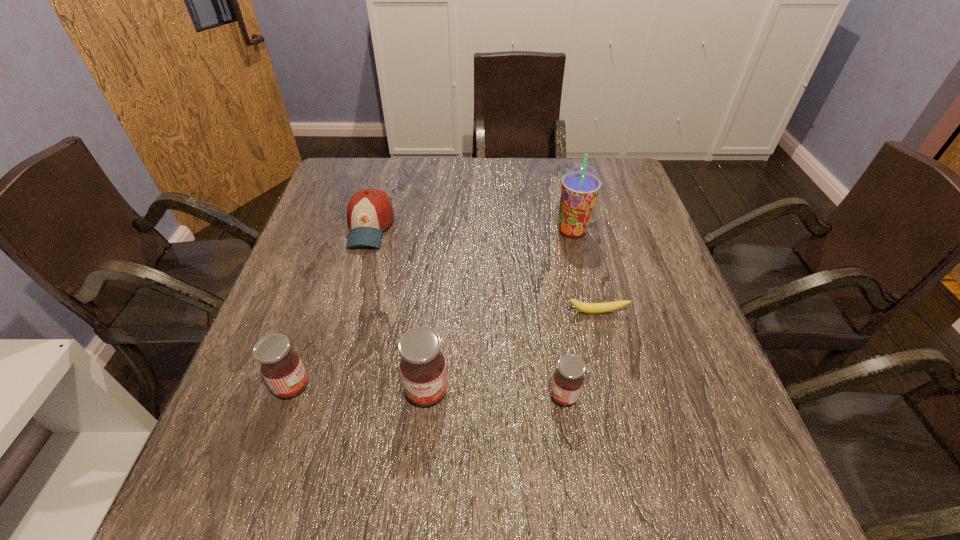
The width and height of the screenshot is (960, 540). I want to click on vacant space that's between the rightmost jam and the baseball cap, so click(467, 312).

What are the coordinates of `free space that is in between the rightmost jam and the baseball cap` in the screenshot? It's located at (467, 312).

Locate an element on the screen. The height and width of the screenshot is (540, 960). vacant area that lies between the fourth nearest object and the third object from right to left is located at coordinates (x=581, y=354).

This screenshot has height=540, width=960. I want to click on free space between the tallest jam and the smoothie, so click(499, 311).

Locate an element on the screen. This screenshot has height=540, width=960. free point between the leftmost jam and the tallest jam is located at coordinates (360, 388).

Locate an element on the screen. The height and width of the screenshot is (540, 960). vacant space that's between the tallest object and the tallest jam is located at coordinates (499, 311).

Identify the location of vacant space that is in between the leftmost jam and the tallest object. (432, 308).

Locate an element on the screen. This screenshot has width=960, height=540. free point between the shortest object and the smoothie is located at coordinates click(x=585, y=272).

This screenshot has width=960, height=540. I want to click on vacant area that lies between the fourth object from left to right and the tallest jam, so click(495, 393).

Choose which object is the second nearest neighbor to the fourth shortest object. Please provide its 2D coordinates. Your answer should be formatted as a tuple, i.e. [(x, y)], where the tuple contains the x and y coordinates of a point satisfying the conditions above.

[(369, 212)]